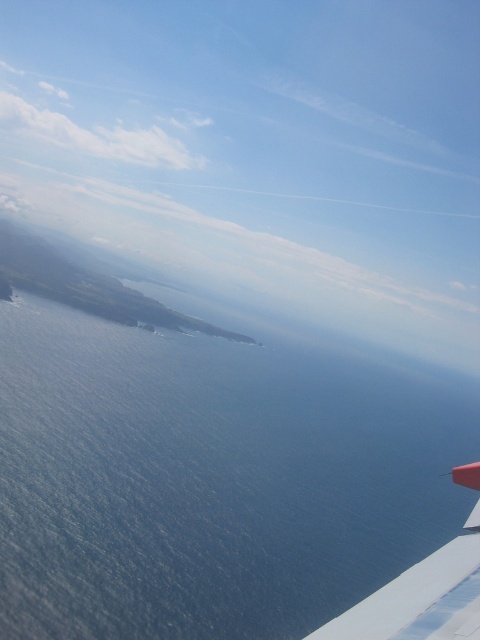
How distant is blue water at lower left from white matte wing at lower right?

blue water at lower left and white matte wing at lower right are 208.31 meters apart.

Is point (121, 397) in front of point (417, 588)?

No, it is not.

At what (x,y) coordinates should I click in order to perform the action: click on blue water at lower left. Please return your answer as a coordinate pair (x, y). The width and height of the screenshot is (480, 640). Looking at the image, I should click on (210, 480).